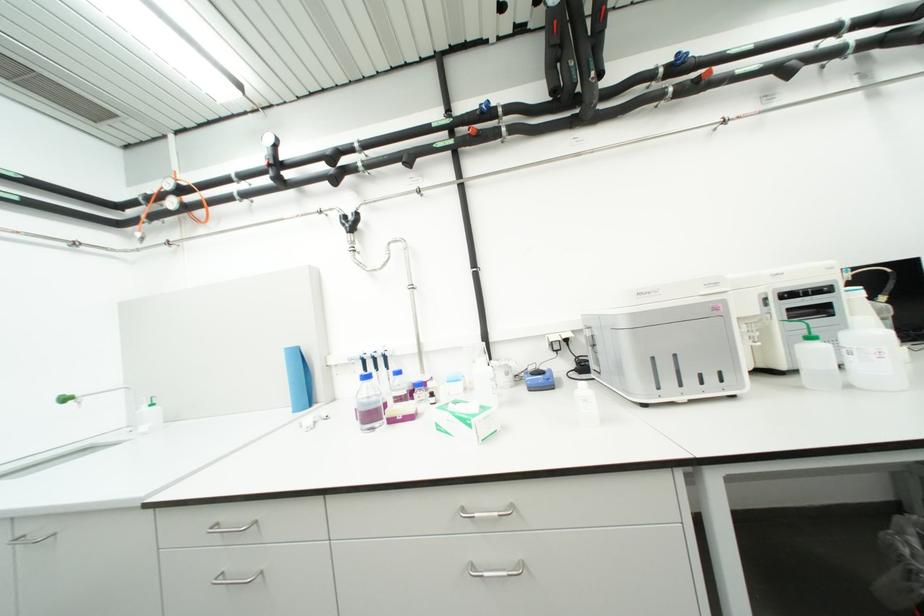
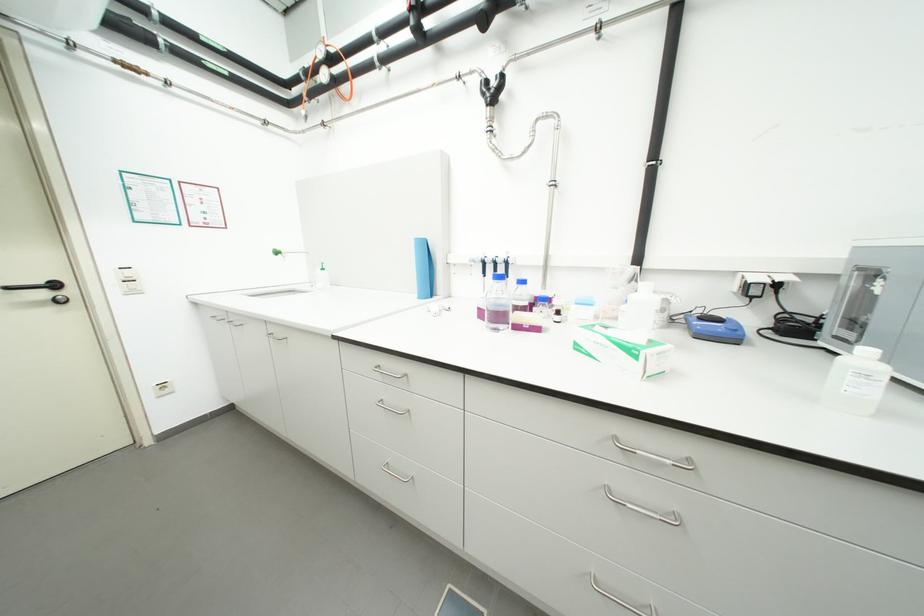
First-person continuous shooting, in which direction is the camera rotating?

The camera rotated toward left-down.